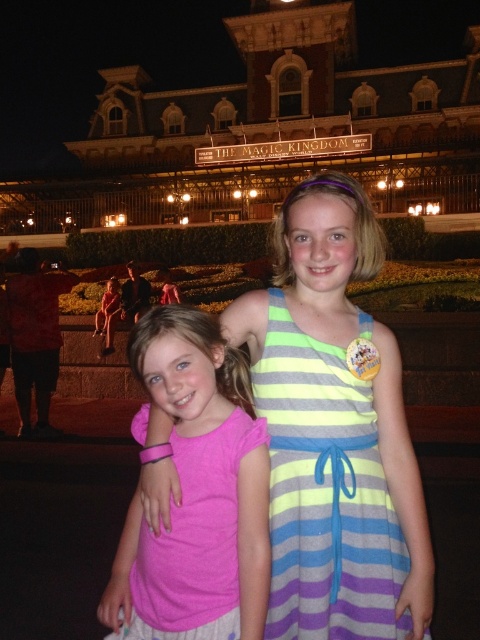
Question: In this image, where is pink fabric dress at center located relative to pink fabric shirt at center?

Choices:
 (A) above
 (B) below

Answer: (A)

Question: Which point appears farthest from the camera in this image?

Choices:
 (A) (x=204, y=461)
 (B) (x=332, y=292)

Answer: (B)

Question: Is pink fabric dress at center further to camera compared to pink fabric shirt at center?

Choices:
 (A) yes
 (B) no

Answer: (A)

Question: Does pink fabric dress at center have a larger size compared to pink fabric shirt at center?

Choices:
 (A) no
 (B) yes

Answer: (B)

Question: Which of the following is the closest to the observer?

Choices:
 (A) pink fabric shirt at center
 (B) pink fabric dress at center

Answer: (A)